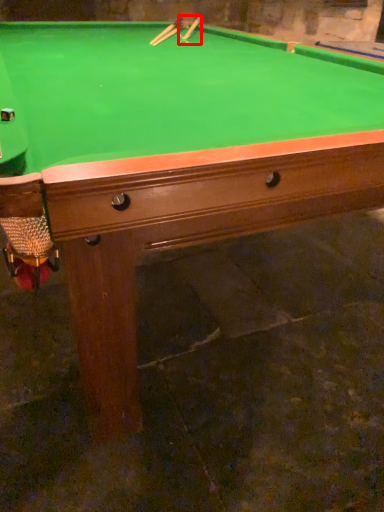
Question: From the image's perspective, where is cue (annotated by the red box) located relative to cue?

Choices:
 (A) below
 (B) above

Answer: (B)